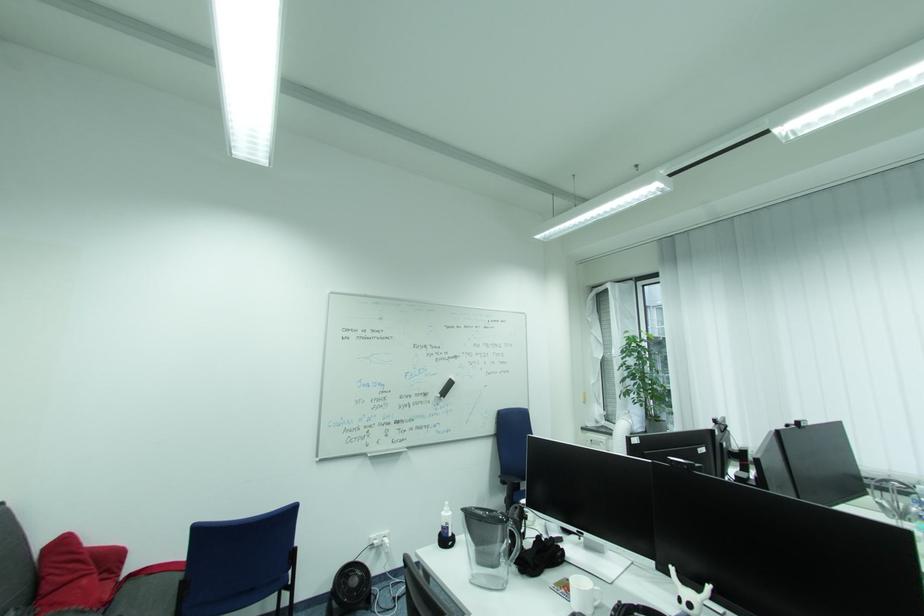
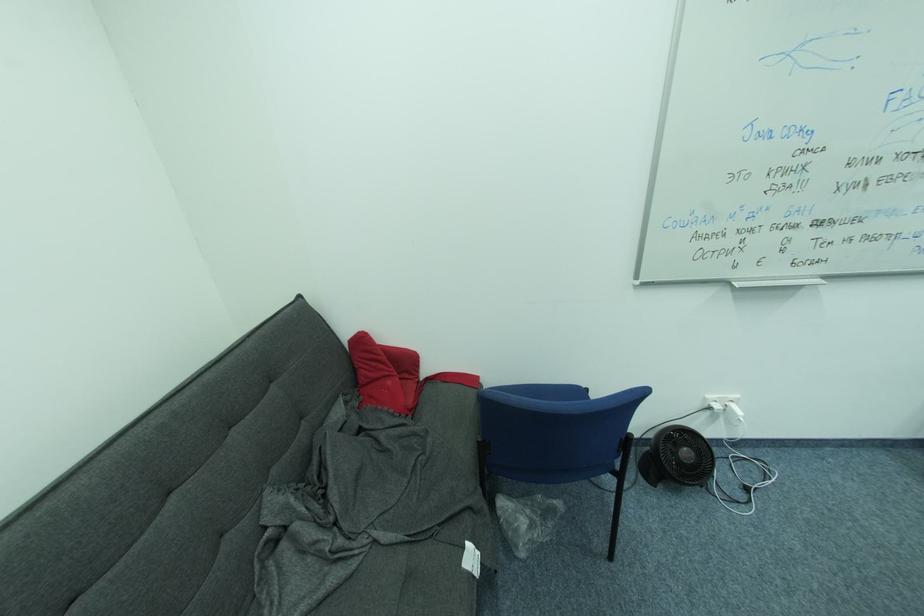
Where in the second image is the point corresponding to the point at 47,543 from the first image?

(353, 336)